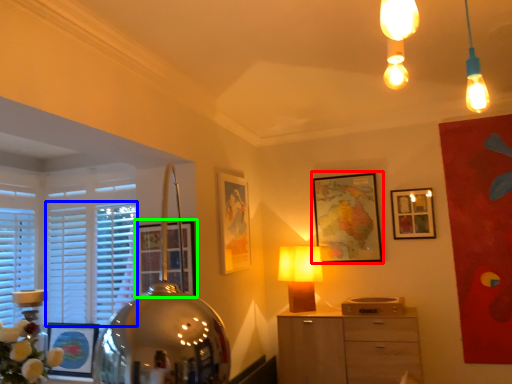
Question: Which object is the farthest from picture frame (highlighted by a red box)? Choose among these: blind (highlighted by a blue box) or picture frame (highlighted by a green box).

Choices:
 (A) blind
 (B) picture frame

Answer: (A)